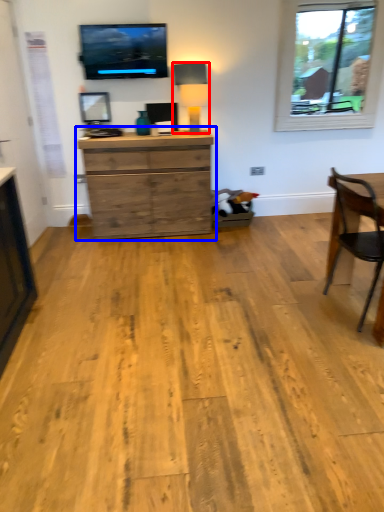
Question: Which object appears farthest to the camera in this image, lamp (highlighted by a red box) or chest of drawers (highlighted by a blue box)?

Choices:
 (A) lamp
 (B) chest of drawers

Answer: (A)